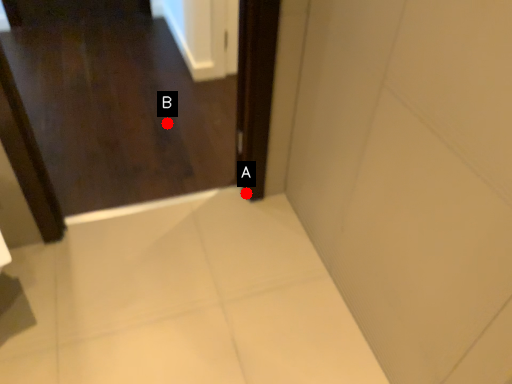
Question: Two points are circled on the image, labeled by A and B beside each circle. Which point is closer to the camera?

Choices:
 (A) A is closer
 (B) B is closer

Answer: (A)